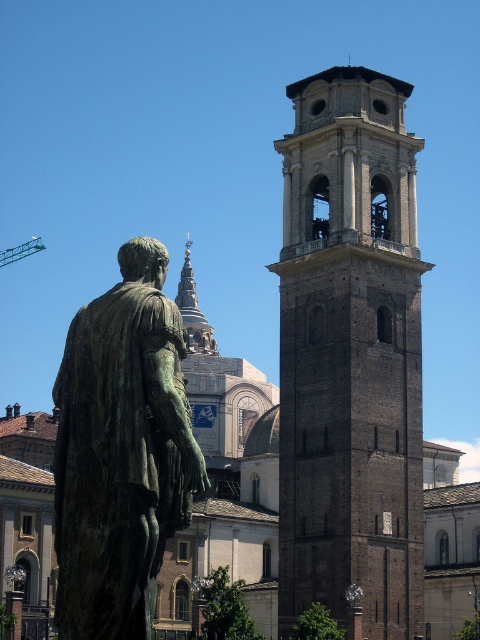
Question: From the image, what is the correct spatial relationship of brown brick tower at center in relation to green patina statue at center?

Choices:
 (A) below
 (B) above

Answer: (A)

Question: Observing the image, what is the correct spatial positioning of brown brick tower at center in reference to green patina statue at center?

Choices:
 (A) left
 (B) right

Answer: (B)

Question: Does brown brick tower at center come in front of green patina statue at center?

Choices:
 (A) yes
 (B) no

Answer: (B)